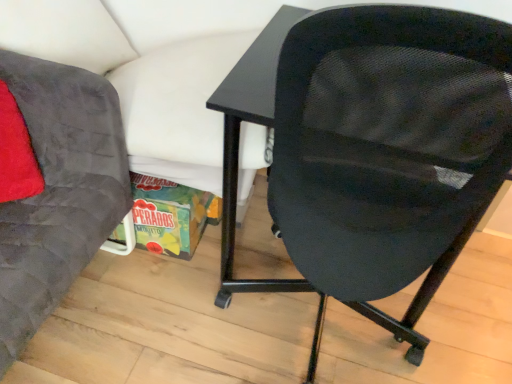
Question: Would you say velvet gray chair at left, which ranks as the first chair in left-to-right order, is to the left or to the right of black mesh chair at center, which is counted as the 2th chair, starting from the left, in the picture?

Choices:
 (A) right
 (B) left

Answer: (B)

Question: Based on their sizes in the image, would you say velvet gray chair at left, which ranks as the first chair in left-to-right order, is bigger or smaller than black mesh chair at center, which is counted as the 2th chair, starting from the left?

Choices:
 (A) big
 (B) small

Answer: (B)

Question: Is velvet gray chair at left, which ranks as the first chair in left-to-right order, spatially inside black mesh chair at center, placed as the first chair when sorted from right to left, or outside of it?

Choices:
 (A) outside
 (B) inside

Answer: (A)

Question: Considering the positions of black mesh chair at center, which is counted as the 2th chair, starting from the left, and velvet gray chair at left, which ranks as the first chair in left-to-right order, in the image, is black mesh chair at center, which is counted as the 2th chair, starting from the left, taller or shorter than velvet gray chair at left, which ranks as the first chair in left-to-right order,?

Choices:
 (A) tall
 (B) short

Answer: (A)

Question: Is black mesh chair at center, which is counted as the 2th chair, starting from the left, spatially inside velvet gray chair at left, which ranks as the first chair in left-to-right order, or outside of it?

Choices:
 (A) outside
 (B) inside

Answer: (A)

Question: In the image, is black mesh chair at center, which is counted as the 2th chair, starting from the left, on the left side or the right side of velvet gray chair at left, which is counted as the second chair, starting from the right?

Choices:
 (A) left
 (B) right

Answer: (B)

Question: From a real-world perspective, is black mesh chair at center, placed as the first chair when sorted from right to left, above or below velvet gray chair at left, which is counted as the second chair, starting from the right?

Choices:
 (A) above
 (B) below

Answer: (A)